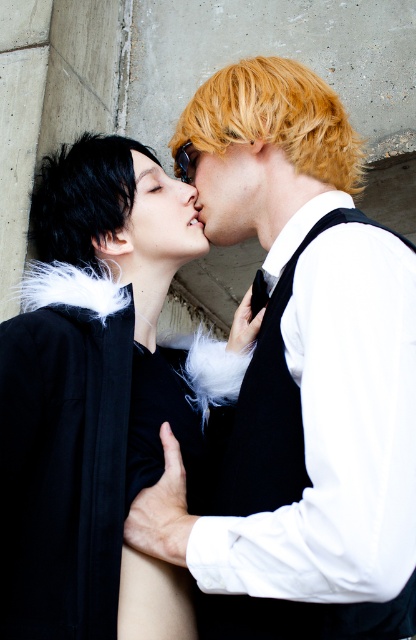
Question: Is blonde hair at center above matte black face at center?

Choices:
 (A) no
 (B) yes

Answer: (B)

Question: Considering the relative positions of black feathered coat at left and black matte hair at upper left in the image provided, where is black feathered coat at left located with respect to black matte hair at upper left?

Choices:
 (A) right
 (B) left

Answer: (A)

Question: Among these objects, which one is nearest to the camera?

Choices:
 (A) blonde hair at center
 (B) black matte hair at upper left
 (C) smooth blonde hair at center
 (D) matte black face at center

Answer: (A)

Question: Which of the following is the closest to the observer?

Choices:
 (A) blonde hair at center
 (B) smooth blonde wig at center
 (C) smooth blonde hair at center

Answer: (B)

Question: Which point is farther to the camera?

Choices:
 (A) (76, 186)
 (B) (193, 148)
 (C) (351, 596)

Answer: (A)

Question: Does blonde hair at center appear on the left side of smooth blonde hair at center?

Choices:
 (A) no
 (B) yes

Answer: (A)